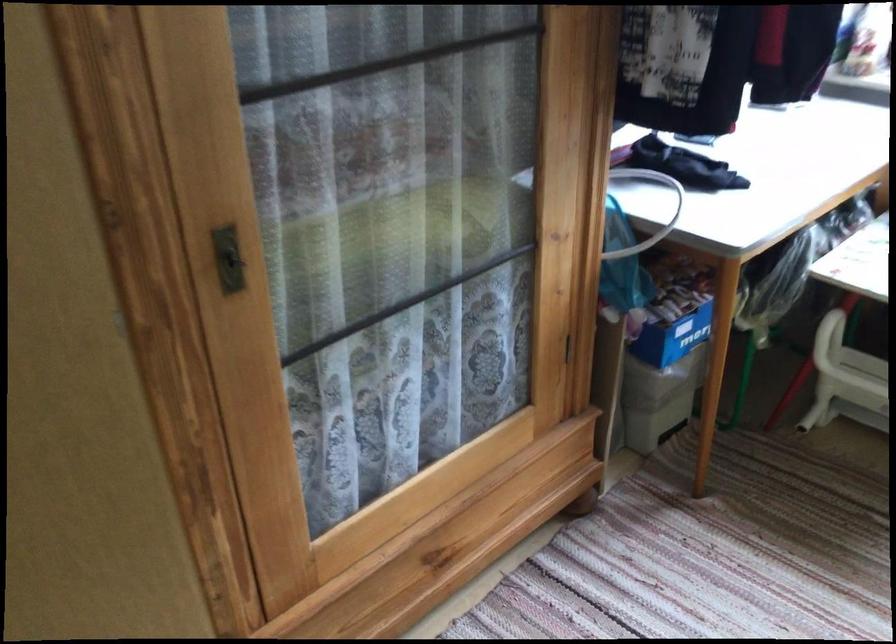
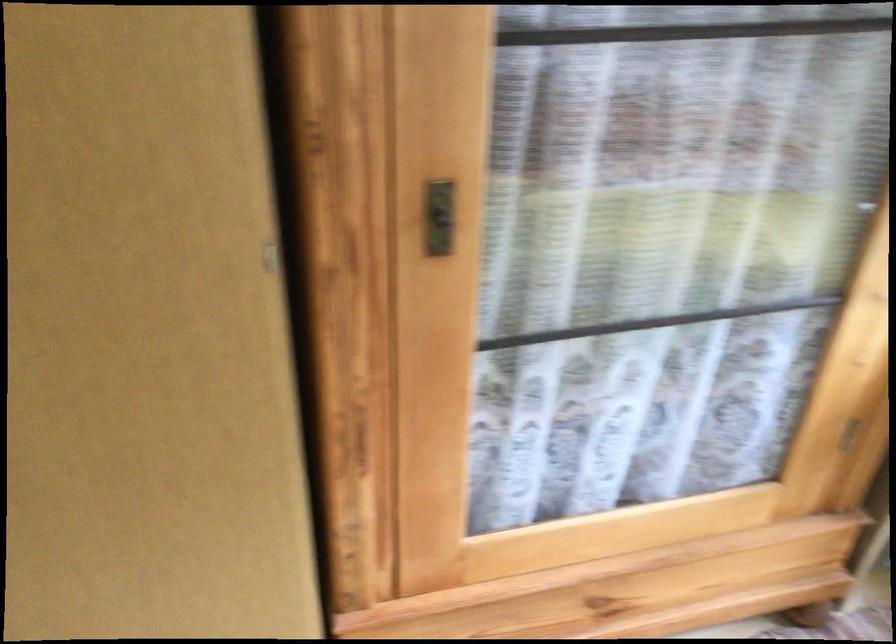
In a continuous first-person perspective shot, in which direction is the camera moving?

The movement direction of the cameraman is right, forward.